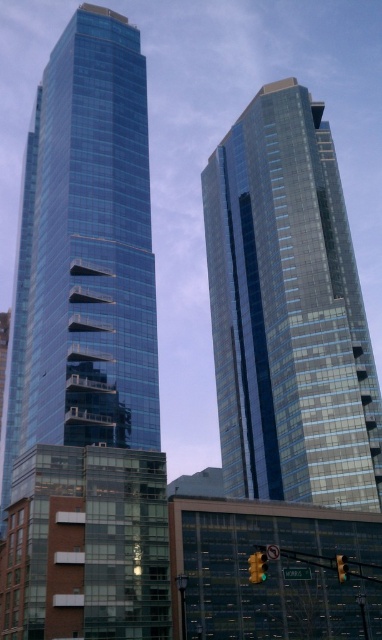
Question: Which is farther from the green glass traffic light at center?

Choices:
 (A) yellow glass traffic light at center
 (B) amber glass traffic light at center

Answer: (B)

Question: Which point is closer to the camera?

Choices:
 (A) shiny glass skyscraper at left
 (B) amber glass traffic light at center
 (C) yellow glass traffic light at center

Answer: (B)

Question: Does shiny glass skyscraper at center have a larger size compared to yellow glass traffic light at center?

Choices:
 (A) yes
 (B) no

Answer: (A)

Question: Which is nearer to the shiny glass skyscraper at center?

Choices:
 (A) shiny glass skyscraper at left
 (B) yellow glass traffic light at center
 (C) amber glass traffic light at center
 (D) green glass traffic light at center

Answer: (A)

Question: Considering the relative positions of yellow glass traffic light at center and green glass traffic light at center in the image provided, where is yellow glass traffic light at center located with respect to green glass traffic light at center?

Choices:
 (A) right
 (B) left

Answer: (B)

Question: Does shiny glass skyscraper at center have a smaller size compared to green glass traffic light at center?

Choices:
 (A) yes
 (B) no

Answer: (B)